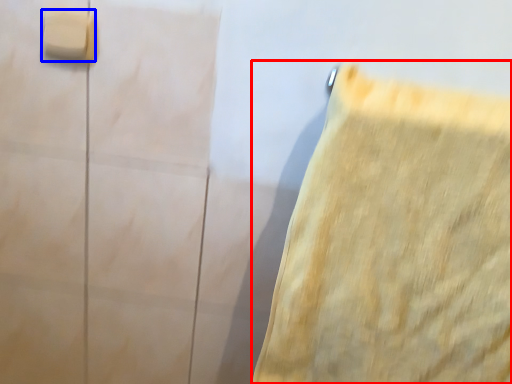
Question: Among these objects, which one is farthest to the camera, towel (highlighted by a red box) or light switch (highlighted by a blue box)?

Choices:
 (A) towel
 (B) light switch

Answer: (B)